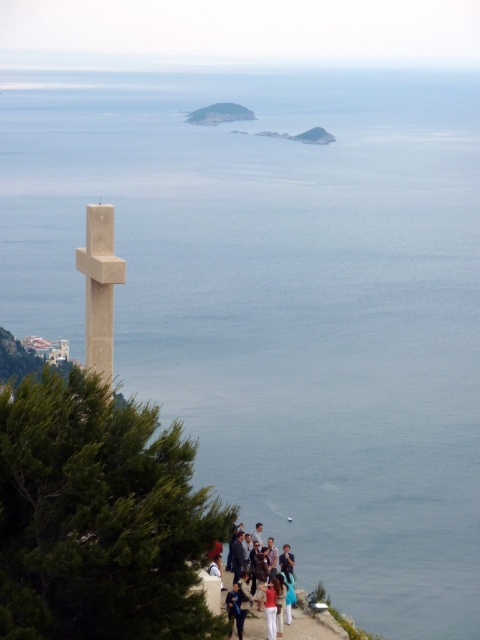
Which is below, matte concrete path at lower center or blue denim jeans at lower center?

blue denim jeans at lower center

Is matte concrete path at lower center below blue denim jeans at lower center?

No, matte concrete path at lower center is not below blue denim jeans at lower center.

You are a GUI agent. You are given a task and a screenshot of the screen. Output one action in this format:
    pyautogui.click(x=<x>, y=<y>)
    Task: Click on the matte concrete path at lower center
    The image size is (480, 640).
    Given the screenshot: What is the action you would take?
    pyautogui.click(x=312, y=627)

In the scene shown: Does smooth concrete cross at center lie behind blue denim jeans at lower center?

No, it is not.

Looking at this image, is smooth concrete cross at center positioned in front of blue denim jeans at lower center?

Yes, smooth concrete cross at center is closer to the viewer.

What do you see at coordinates (99, 285) in the screenshot? The image size is (480, 640). I see `smooth concrete cross at center` at bounding box center [99, 285].

Find the location of `smooth concrete cross at center`. smooth concrete cross at center is located at coordinates (99, 285).

Does smooth concrete cross at center come behind matte concrete path at lower center?

Yes.

Which of these two, smooth concrete cross at center or matte concrete path at lower center, stands shorter?

Standing shorter between the two is matte concrete path at lower center.

Where is `smooth concrete cross at center`? This screenshot has width=480, height=640. smooth concrete cross at center is located at coordinates (99, 285).

In order to click on smooth concrete cross at center in this screenshot , I will do `click(99, 285)`.